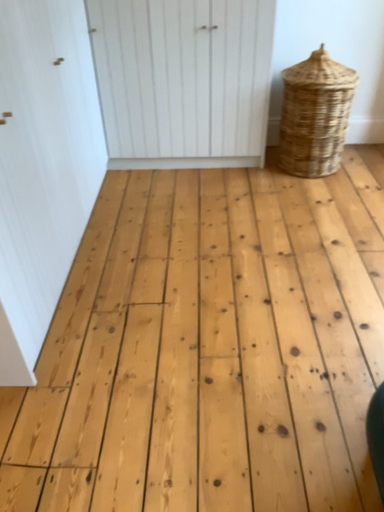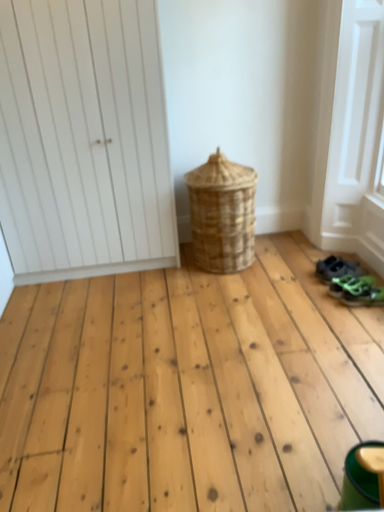
Question: How did the camera likely rotate when shooting the video?

Choices:
 (A) rotated upward
 (B) rotated downward

Answer: (A)